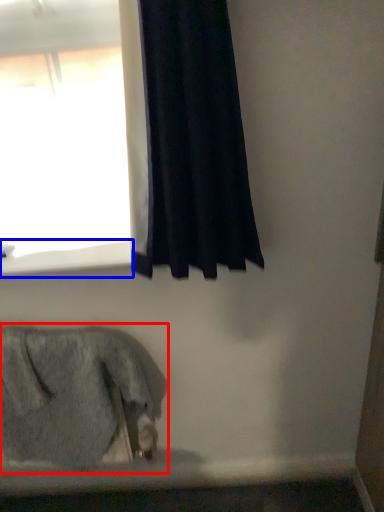
Question: Which of the following is the closest to the observer, animal (highlighted by a red box) or window sill (highlighted by a blue box)?

Choices:
 (A) animal
 (B) window sill

Answer: (A)